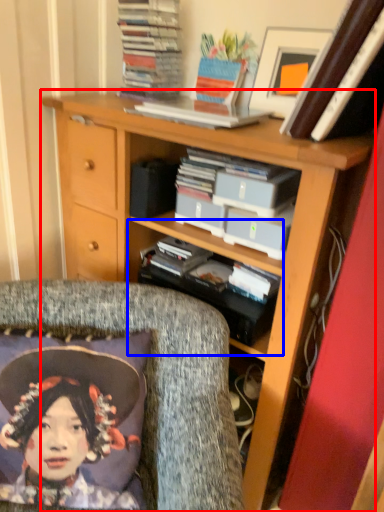
Question: Which point is further to the camera, bookcase (highlighted by a red box) or shelf (highlighted by a blue box)?

Choices:
 (A) bookcase
 (B) shelf

Answer: (B)